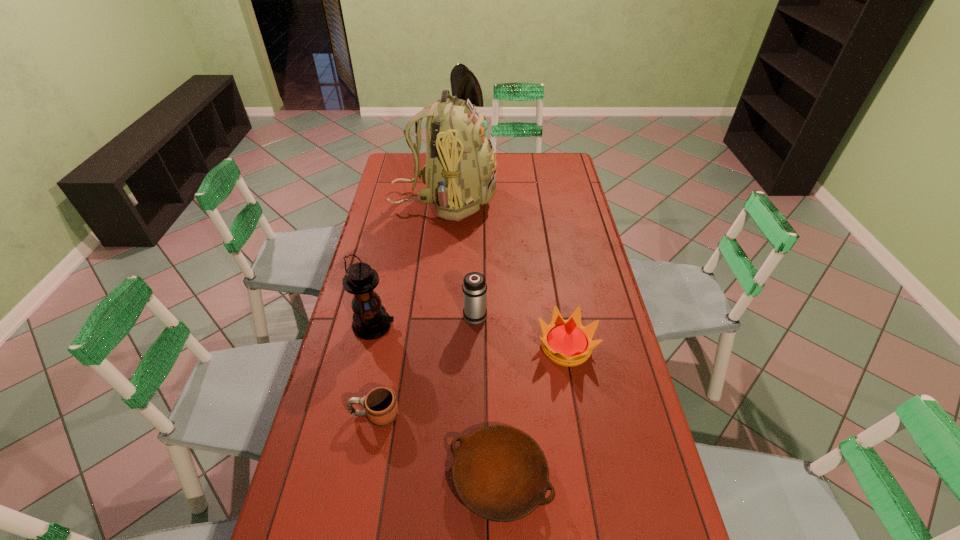
Where is `backpack`? This screenshot has height=540, width=960. backpack is located at coordinates (460, 173).

The width and height of the screenshot is (960, 540). I want to click on the farthest object, so [x=460, y=173].

Where is `the fifth shortest object`? This screenshot has height=540, width=960. the fifth shortest object is located at coordinates (371, 321).

Where is `thermos bottle`? This screenshot has width=960, height=540. thermos bottle is located at coordinates (474, 287).

Locate an element on the screen. The height and width of the screenshot is (540, 960). the fourth tallest object is located at coordinates (567, 343).

Find the location of `crown`. crown is located at coordinates (567, 343).

The image size is (960, 540). Find the location of `the fifth tallest object`. the fifth tallest object is located at coordinates (381, 407).

Where is `the second nearest object`? the second nearest object is located at coordinates (381, 407).

The height and width of the screenshot is (540, 960). What are the coordinates of `the nearest object` in the screenshot? It's located at (500, 473).

The image size is (960, 540). Identify the location of plate. (500, 473).